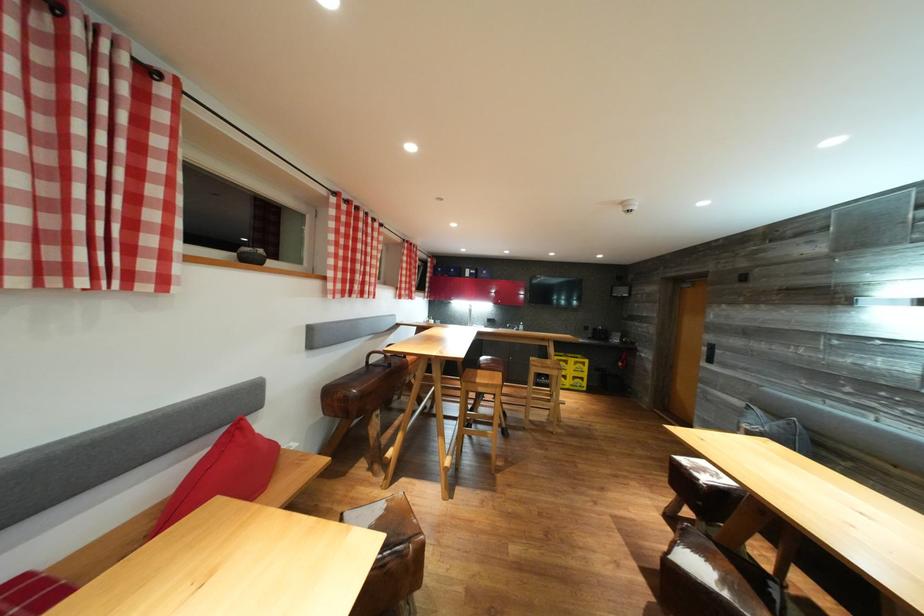
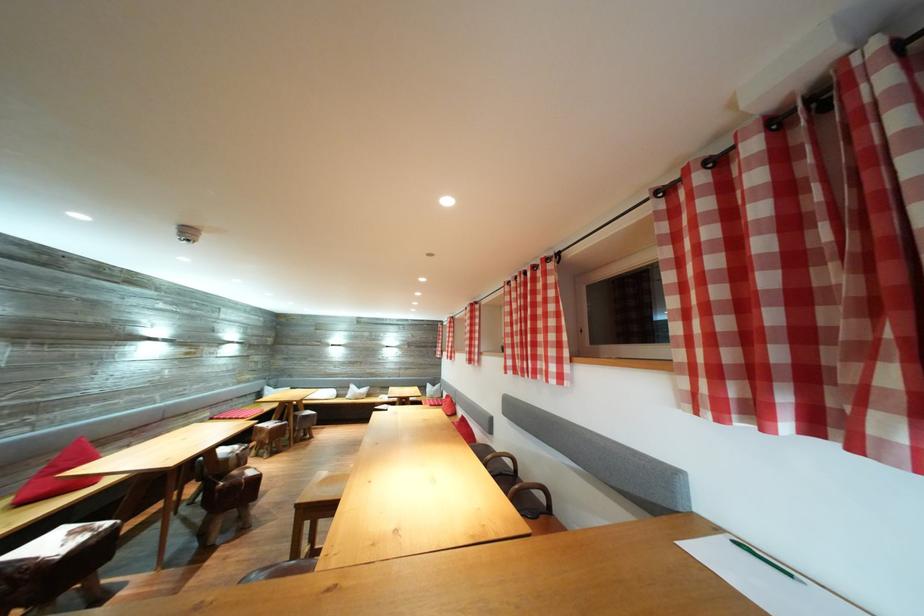
Question: I am providing you with two images of the same scene from different viewpoints. Which of the following objects are not visible in image2?

Choices:
 (A) Golf magazine
 (B) red checkered curtain
 (C) red triangular pillow
 (D) green pencil

Answer: (B)